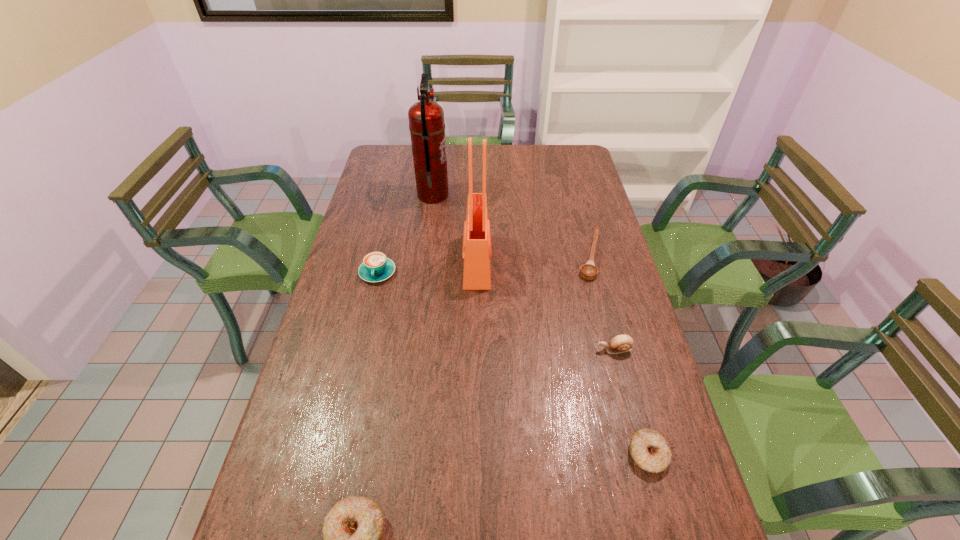
Identify the location of object that is the fifth closest to the cappuccino. (353, 529).

You are a GUI agent. You are given a task and a screenshot of the screen. Output one action in this format:
    pyautogui.click(x=<x>, y=<y>)
    Task: Click on the free spot that satisfies the following two spatial constraints: 1. on the logo side of the fourth object from left to right; 2. on the left side of the shorter doughnut
    
    Given the screenshot: What is the action you would take?
    pyautogui.click(x=475, y=454)

Find the location of a particular element. The height and width of the screenshot is (540, 960). vacant space that satisfies the following two spatial constraints: 1. on the front-facing side of the third nearest object; 2. on the right side of the sixth tallest object is located at coordinates [641, 454].

Identify the location of free location that satisfies the following two spatial constraints: 1. on the logo side of the fourth object from left to right; 2. with the handle on the right side of the cappuccino. (477, 273).

I want to click on blank area in the image that satisfies the following two spatial constraints: 1. on the logo side of the fourth object from right to left; 2. with the handle on the right side of the cappuccino, so click(x=477, y=273).

At what (x,y) coordinates should I click in order to perform the action: click on vacant area that satisfies the following two spatial constraints: 1. on the front-facing side of the escargot; 2. on the back side of the second shortest object. Please return your answer as a coordinate pair (x, y). The height and width of the screenshot is (540, 960). Looking at the image, I should click on (641, 454).